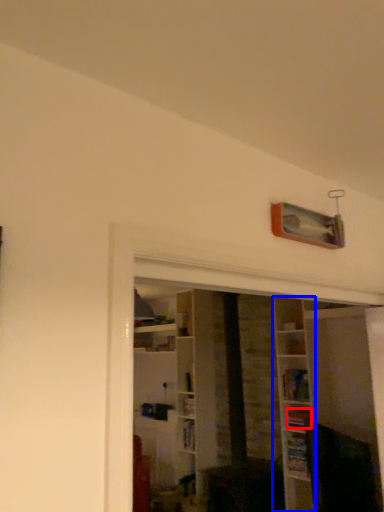
Question: Which object is closer to the camera taking this photo, book (highlighted by a red box) or shelf (highlighted by a blue box)?

Choices:
 (A) book
 (B) shelf

Answer: (B)